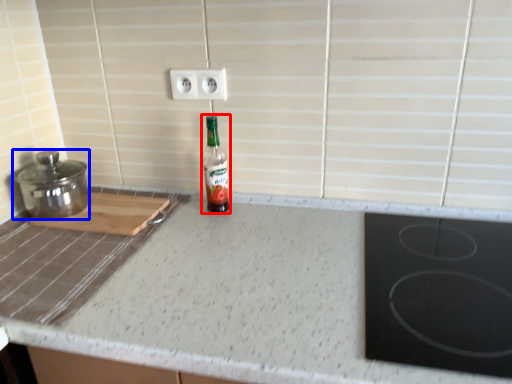
Question: Which object is closer to the camera taking this photo, bottle (highlighted by a red box) or kitchen appliance (highlighted by a blue box)?

Choices:
 (A) bottle
 (B) kitchen appliance

Answer: (B)